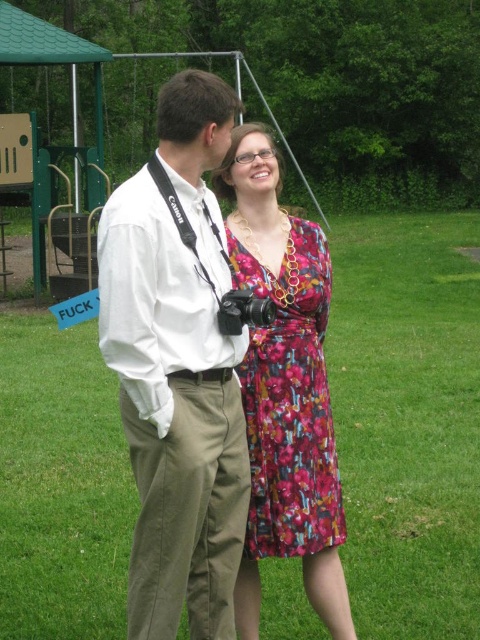
You are standing at the point marked by the coordinate point at (382,621). You want to walk to the nearest person. Which direction should you go?

The two people are 3.55 meters apart. Since you are at the point marked by the coordinate point at (382,621), you should walk towards the nearest person, but without knowing their exact positions relative to the coordinate, I cannot determine the direction. Please provide more information about their locations.

You are organizing a photoshoot and need to place a 2m wide backdrop behind both the white cotton shirt at center and the floral silk dress at center. Will the backdrop be sufficient to cover both objects?

The white cotton shirt at center might be wider than floral silk dress at center, so the total width required could be up to twice the width of the shirt. Since the backdrop is 2 meters wide, it depends on the combined width of both objects. If the shirt is wider than the dress, the total might exceed 2 meters, making the backdrop insufficient. However, without exact measurements, we can only estimate based on the given information.